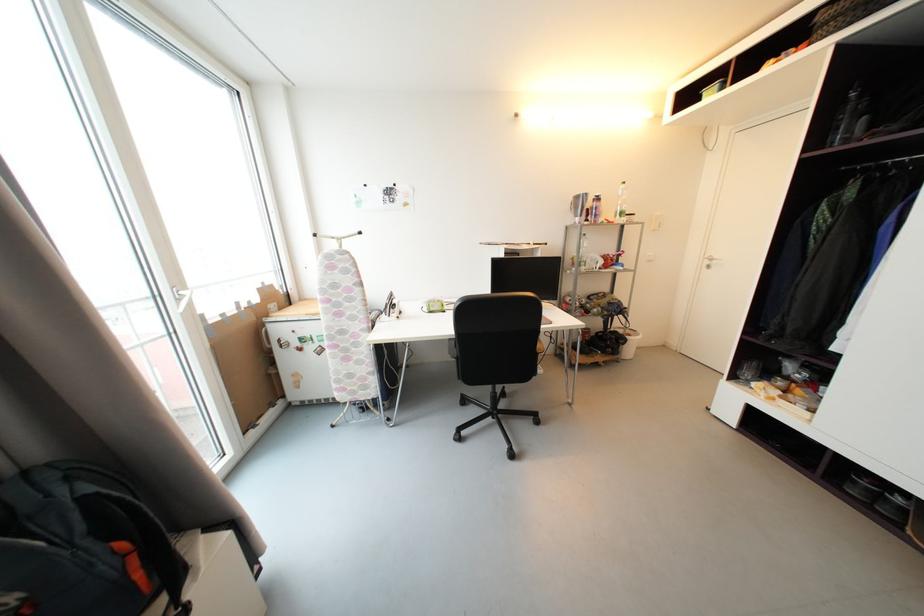
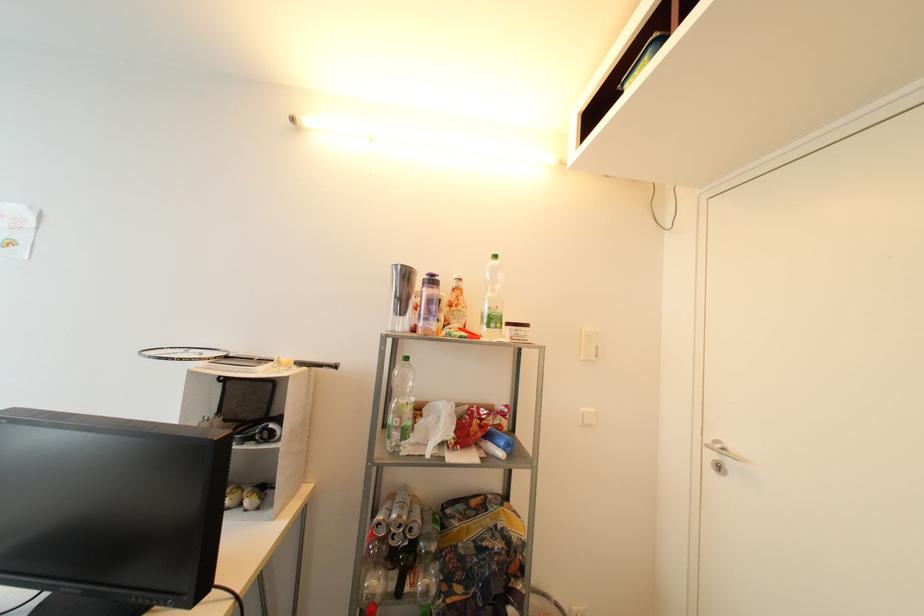
Locate, in the second image, the point that corresponds to (602,201) in the first image.

(438, 283)